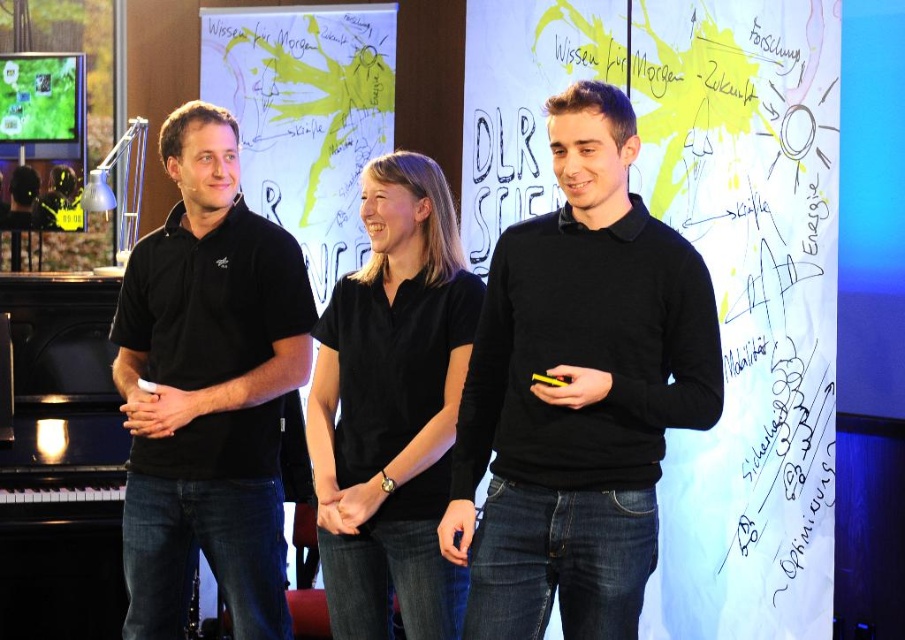
You are standing in the conference room and want to take a photo of both the point at coordinates point (497,280) and point (214,364). To ensure both are in focus, which point should you focus on first?

You should focus on point (497,280) first because it is closer to the camera than point (214,364). This ensures that the closer point is in focus, and the farther point may also be within the depth of field.

You are organizing a clothing donation drive and need to categorize items by size. You have two black matte garments in front of you, the black matte sweater at center and the black matte shirt at left. Which one should you place in the small size bin?

The black matte sweater at center is smaller than the black matte shirt at left, so it should be placed in the small size bin.